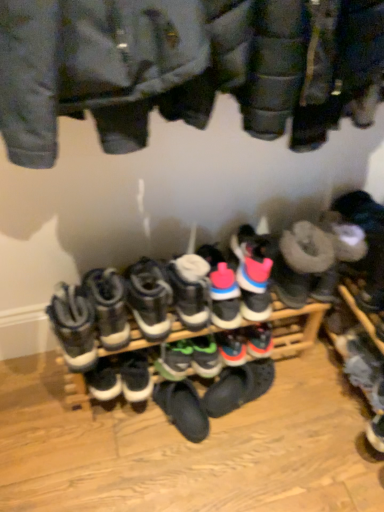
Question: Should I look upward or downward to see white leather sneakers at center, which is the eighth footwear in right-to-left order?

Choices:
 (A) down
 (B) up

Answer: (A)

Question: Is black suede sneaker at center, marked as the third footwear in a left-to-right arrangement, closer to the viewer compared to pink suede sneakers at center, which ranks as the 3th footwear in right-to-left order?

Choices:
 (A) no
 (B) yes

Answer: (A)

Question: From the image's perspective, is black suede sneaker at center, the seventh footwear when ordered from right to left, on pink suede sneakers at center, which ranks as the 3th footwear in right-to-left order?

Choices:
 (A) yes
 (B) no

Answer: (B)

Question: Does black suede sneaker at center, the seventh footwear when ordered from right to left, lie behind pink suede sneakers at center, which ranks as the 3th footwear in right-to-left order?

Choices:
 (A) yes
 (B) no

Answer: (A)

Question: Is black suede sneaker at center, the seventh footwear when ordered from right to left, turned away from pink suede sneakers at center, the seventh footwear positioned from the left?

Choices:
 (A) no
 (B) yes

Answer: (A)

Question: Does black suede sneaker at center, the seventh footwear when ordered from right to left, appear on the right side of pink suede sneakers at center, which ranks as the 3th footwear in right-to-left order?

Choices:
 (A) no
 (B) yes

Answer: (A)

Question: From a real-world perspective, is black suede sneaker at center, marked as the third footwear in a left-to-right arrangement, beneath pink suede sneakers at center, the seventh footwear positioned from the left?

Choices:
 (A) no
 (B) yes

Answer: (B)

Question: Could you tell me if white suede sneaker at lower right, positioned as the 2th footwear in right-to-left order, is turned towards black suede sneaker at center, marked as the third footwear in a left-to-right arrangement?

Choices:
 (A) no
 (B) yes

Answer: (B)

Question: From the image's perspective, is white suede sneaker at lower right, positioned as the 2th footwear in right-to-left order, below black suede sneaker at center, marked as the third footwear in a left-to-right arrangement?

Choices:
 (A) no
 (B) yes

Answer: (B)

Question: From a real-world perspective, is white suede sneaker at lower right, which is the eighth footwear in left-to-right order, on top of black suede sneaker at center, marked as the third footwear in a left-to-right arrangement?

Choices:
 (A) no
 (B) yes

Answer: (A)

Question: Considering the relative sizes of white suede sneaker at lower right, positioned as the 2th footwear in right-to-left order, and black suede sneaker at center, the seventh footwear when ordered from right to left, in the image provided, is white suede sneaker at lower right, positioned as the 2th footwear in right-to-left order, shorter than black suede sneaker at center, the seventh footwear when ordered from right to left,?

Choices:
 (A) yes
 (B) no

Answer: (A)

Question: Can you confirm if white suede sneaker at lower right, which is the eighth footwear in left-to-right order, is bigger than black suede sneaker at center, the seventh footwear when ordered from right to left?

Choices:
 (A) yes
 (B) no

Answer: (A)

Question: Could black suede sneaker at center, marked as the third footwear in a left-to-right arrangement, be considered to be inside white suede sneaker at lower right, which is the eighth footwear in left-to-right order?

Choices:
 (A) yes
 (B) no

Answer: (B)

Question: Is green suede sneakers at center, the fifth footwear positioned from the right, behind pink suede sneakers at center, which ranks as the 3th footwear in right-to-left order?

Choices:
 (A) yes
 (B) no

Answer: (A)